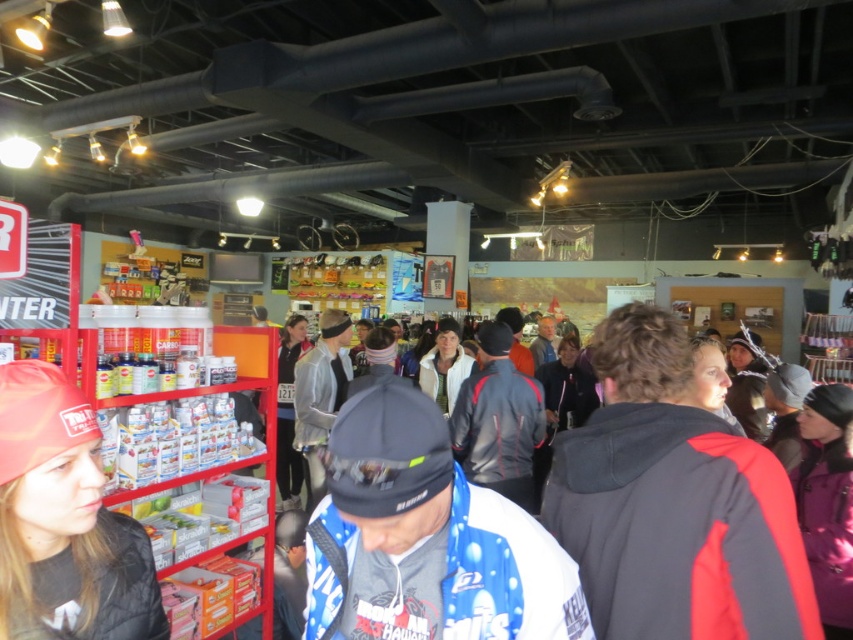
You are a customer in the store and want to buy a gift for a friend. You see the blue fleece jacket at center and the red knit cap at left. If you want to choose the bigger item as a gift, which one should you pick?

The blue fleece jacket at center is larger in size than the red knit cap at left, so you should pick the blue fleece jacket at center as it is bigger.

You are a customer in the store looking for a jacket and a hat. You see the blue fleece jacket at center and the red knit cap at left. Which item is positioned higher on the shelf?

The red knit cap at left is positioned higher on the shelf than the blue fleece jacket at center because the blue fleece jacket at center is located below the red knit cap at left.